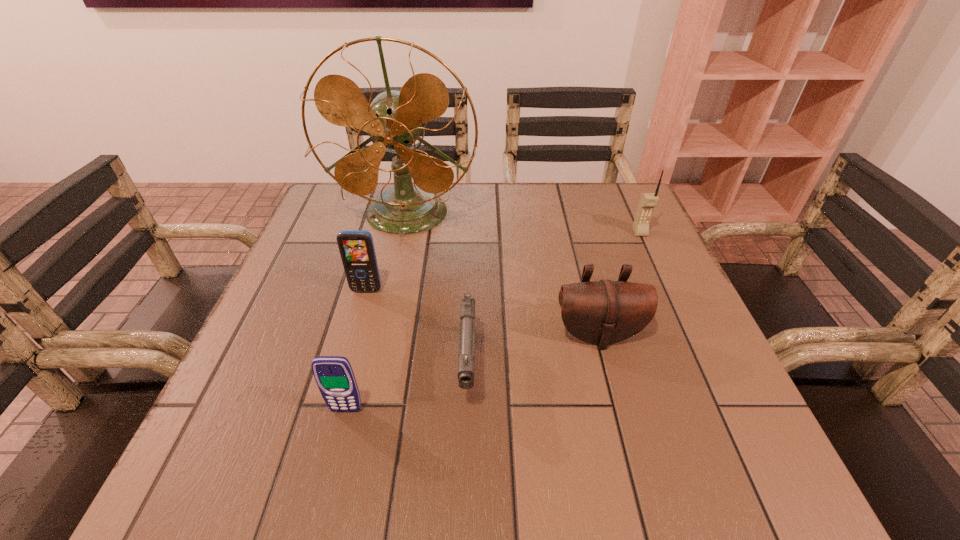
The image size is (960, 540). I want to click on vacant space located with the flap open on the pouch, so click(629, 451).

Where is `vacant area situated on the front-facing side of the nearest cellular telephone`? The height and width of the screenshot is (540, 960). vacant area situated on the front-facing side of the nearest cellular telephone is located at coordinates (333, 461).

Identify the location of fan that is at the far edge. (394, 120).

Where is `cellular telephone that is at the far edge`? This screenshot has width=960, height=540. cellular telephone that is at the far edge is located at coordinates (648, 201).

The height and width of the screenshot is (540, 960). Identify the location of fan that is at the left edge. (394, 120).

Identify the location of cellular telephone that is at the left edge. This screenshot has width=960, height=540. (356, 247).

This screenshot has width=960, height=540. What are the coordinates of `cellular telephone present at the right edge` in the screenshot? It's located at (648, 201).

What are the coordinates of `pouch that is at the right edge` in the screenshot? It's located at (603, 312).

The image size is (960, 540). I want to click on object that is at the far left corner, so [394, 120].

In order to click on object positioned at the far right corner in this screenshot , I will do `click(648, 201)`.